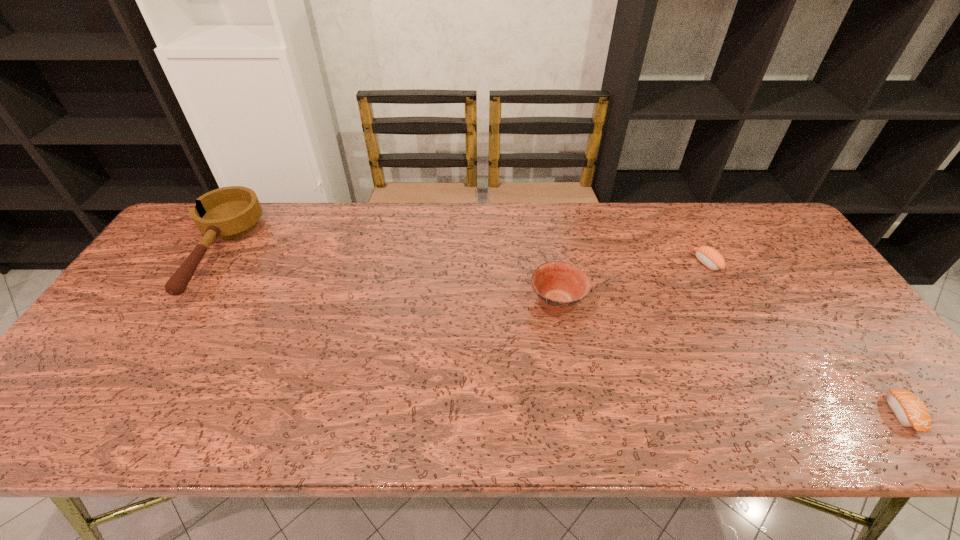
The image size is (960, 540). I want to click on free spot at the near left corner of the desktop, so click(x=24, y=438).

The width and height of the screenshot is (960, 540). I want to click on vacant space in between the bowl and the second shortest object, so click(x=632, y=282).

Image resolution: width=960 pixels, height=540 pixels. What are the coordinates of `vacant space that is in between the third tallest object and the bowl` in the screenshot? It's located at (632, 282).

Locate an element on the screen. This screenshot has height=540, width=960. free space between the saucepan and the third tallest object is located at coordinates (463, 258).

The height and width of the screenshot is (540, 960). What are the coordinates of `vacant area that lies between the third object from right to left and the shortest object` in the screenshot? It's located at (730, 357).

Locate an element on the screen. Image resolution: width=960 pixels, height=540 pixels. vacant space that's between the second object from left to right and the nearer sushi is located at coordinates (730, 357).

At what (x,y) coordinates should I click in order to perform the action: click on vacant region between the taller sushi and the shortest object. Please return your answer as a coordinate pair (x, y). Looking at the image, I should click on (804, 338).

Locate an element on the screen. free point between the saucepan and the second object from right to left is located at coordinates (463, 258).

Where is `vacant space that's between the saucepan and the rightmost object`? vacant space that's between the saucepan and the rightmost object is located at coordinates (560, 333).

Image resolution: width=960 pixels, height=540 pixels. Identify the location of free area in between the second object from left to right and the second shortest object. (632, 282).